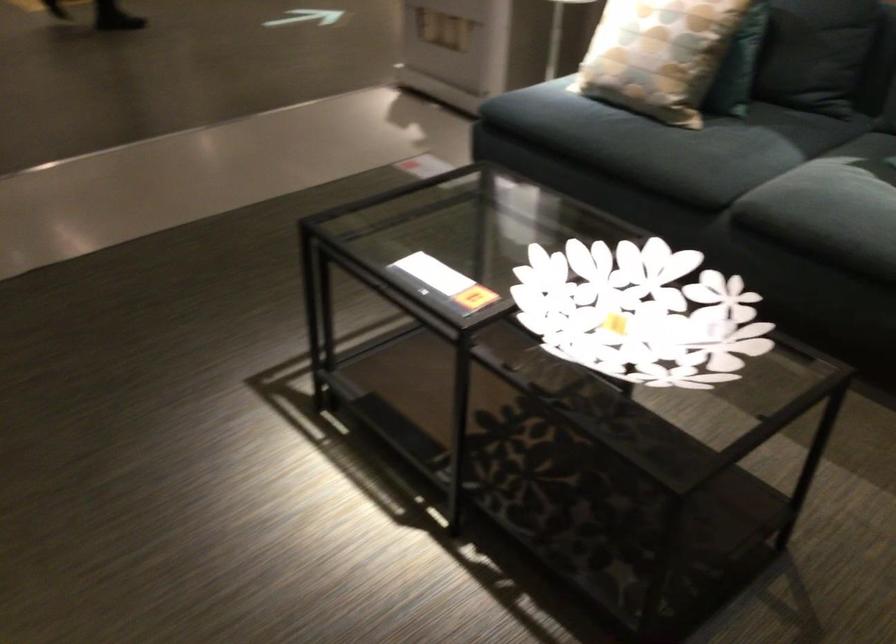
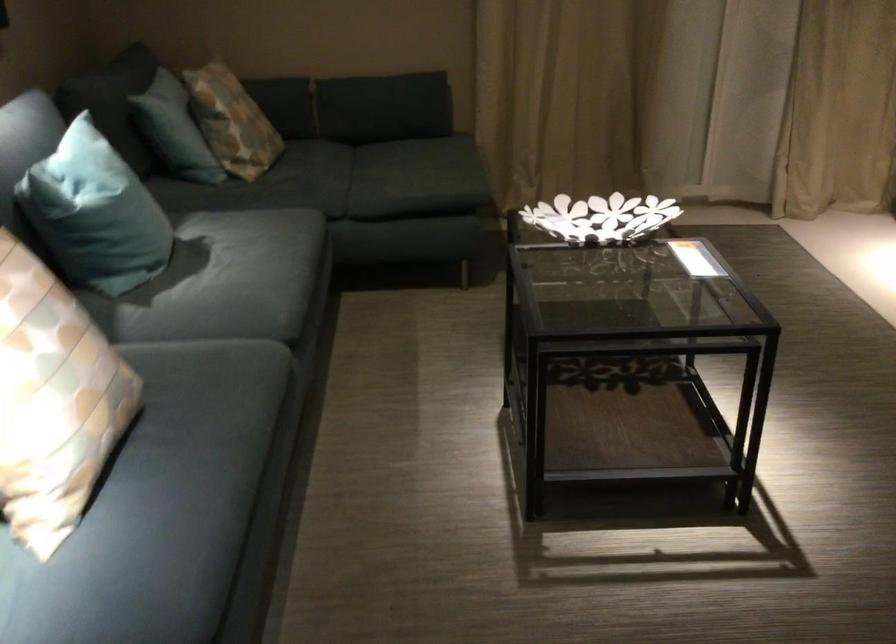
Find the pixel in the second image that matches point (651, 375) in the first image.

(600, 218)